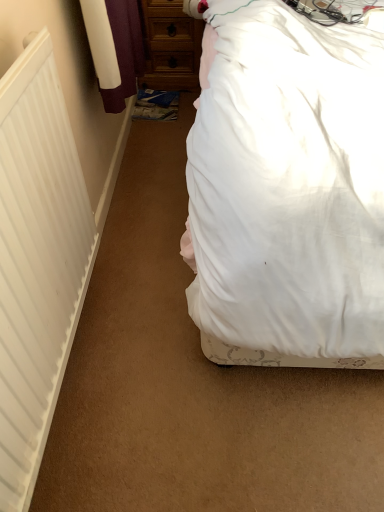
Question: From a real-world perspective, relative to wooden chest of drawers at upper center, is white fabric bed at upper right vertically above or below?

Choices:
 (A) above
 (B) below

Answer: (A)

Question: Which is correct: white fabric bed at upper right is inside wooden chest of drawers at upper center, or outside of it?

Choices:
 (A) outside
 (B) inside

Answer: (A)

Question: Estimate the real-world distances between objects in this image. Which object is farther from the wooden chest of drawers at upper center?

Choices:
 (A) white fabric bed at upper right
 (B) white matte radiator at left

Answer: (B)

Question: Estimate the real-world distances between objects in this image. Which object is closer to the white fabric bed at upper right?

Choices:
 (A) wooden chest of drawers at upper center
 (B) white matte radiator at left

Answer: (B)